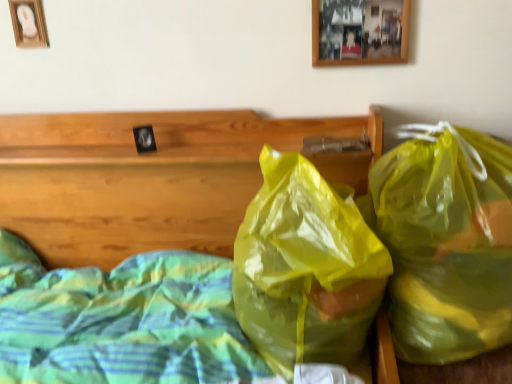
Question: Is wooden picture frame at upper center, the 1th picture frame positioned from the front, smaller than translucent plastic bags at center?

Choices:
 (A) yes
 (B) no

Answer: (A)

Question: Can you confirm if wooden picture frame at upper center, the second picture frame positioned from the left, is taller than translucent plastic bags at center?

Choices:
 (A) no
 (B) yes

Answer: (A)

Question: Does wooden picture frame at upper center, acting as the 2th picture frame starting from the back, lie in front of translucent plastic bags at center?

Choices:
 (A) no
 (B) yes

Answer: (A)

Question: From a real-world perspective, is wooden picture frame at upper center, the second picture frame positioned from the left, on top of translucent plastic bags at center?

Choices:
 (A) no
 (B) yes

Answer: (B)

Question: Does wooden picture frame at upper center, acting as the 2th picture frame starting from the back, come behind translucent plastic bags at center?

Choices:
 (A) yes
 (B) no

Answer: (A)

Question: Is point (500, 311) positioned closer to the camera than point (372, 6)?

Choices:
 (A) farther
 (B) closer

Answer: (B)

Question: From the image's perspective, is translucent yellow plastic bag at right, the second plastic bag viewed from the left, above or below wooden picture frame at upper center, which ranks as the first picture frame in right-to-left order?

Choices:
 (A) below
 (B) above

Answer: (A)

Question: Is translucent yellow plastic bag at right, which is counted as the 1th plastic bag, starting from the right, situated inside wooden picture frame at upper center, the second picture frame positioned from the left, or outside?

Choices:
 (A) outside
 (B) inside

Answer: (A)

Question: Based on their sizes in the image, would you say translucent yellow plastic bag at right, which is counted as the 1th plastic bag, starting from the right, is bigger or smaller than wooden picture frame at upper center, acting as the 2th picture frame starting from the back?

Choices:
 (A) small
 (B) big

Answer: (B)

Question: In terms of height, does wooden picture frame at upper center, the second picture frame positioned from the left, look taller or shorter compared to translucent yellow plastic bag at right, the second plastic bag viewed from the left?

Choices:
 (A) tall
 (B) short

Answer: (B)

Question: In the image, is wooden picture frame at upper center, the second picture frame positioned from the left, on the left side or the right side of translucent yellow plastic bag at right, the second plastic bag viewed from the left?

Choices:
 (A) left
 (B) right

Answer: (A)

Question: Is wooden picture frame at upper center, acting as the 2th picture frame starting from the back, wider or thinner than translucent yellow plastic bag at right, the second plastic bag viewed from the left?

Choices:
 (A) thin
 (B) wide

Answer: (A)

Question: Is wooden picture frame at upper center, which ranks as the first picture frame in right-to-left order, in front of or behind translucent yellow plastic bag at right, the second plastic bag viewed from the left, in the image?

Choices:
 (A) behind
 (B) front

Answer: (A)

Question: From a real-world perspective, is translucent yellow plastic bag at center, which is counted as the second plastic bag, starting from the right, positioned above or below translucent plastic bags at center?

Choices:
 (A) below
 (B) above

Answer: (B)

Question: Relative to translucent plastic bags at center, is translucent yellow plastic bag at center, which is counted as the second plastic bag, starting from the right, in front or behind?

Choices:
 (A) behind
 (B) front

Answer: (A)